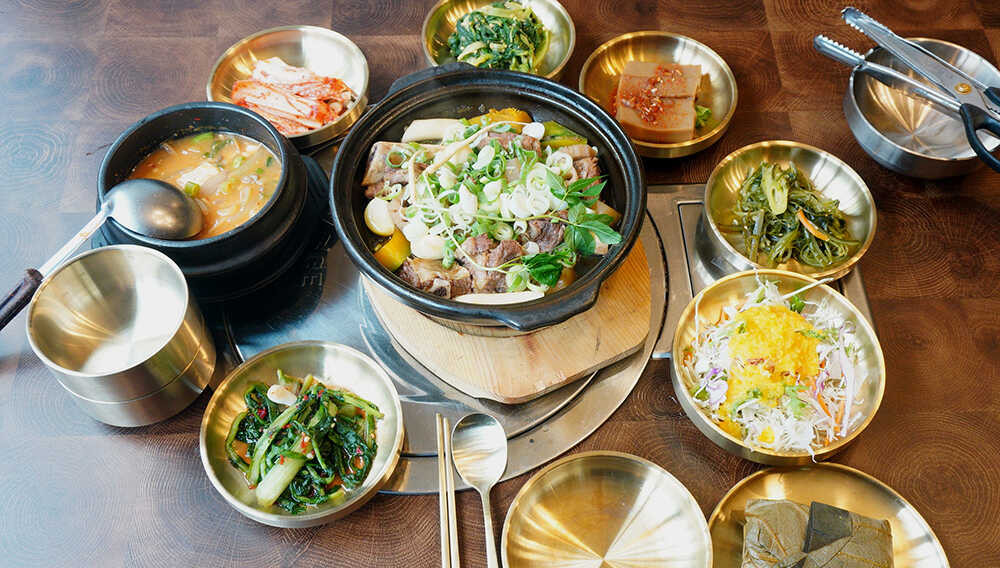
The height and width of the screenshot is (568, 1000). What are the coordinates of `countertop` in the screenshot? It's located at (940, 355).